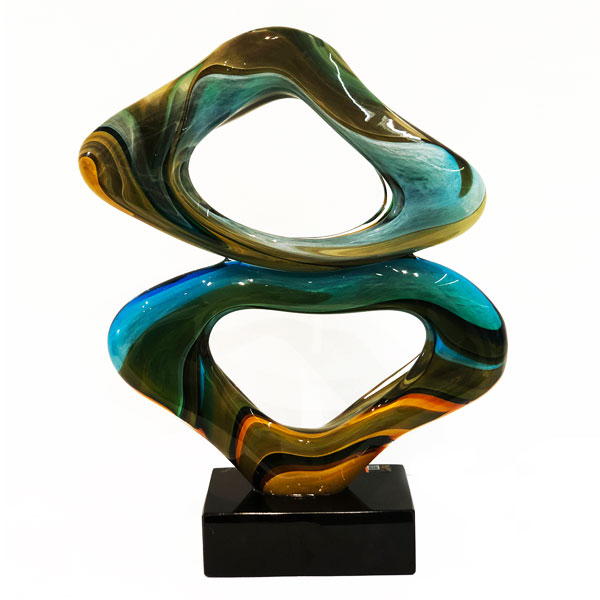
Image resolution: width=600 pixels, height=600 pixels. I want to click on shadow from ceramic artwork, so click(x=342, y=501).